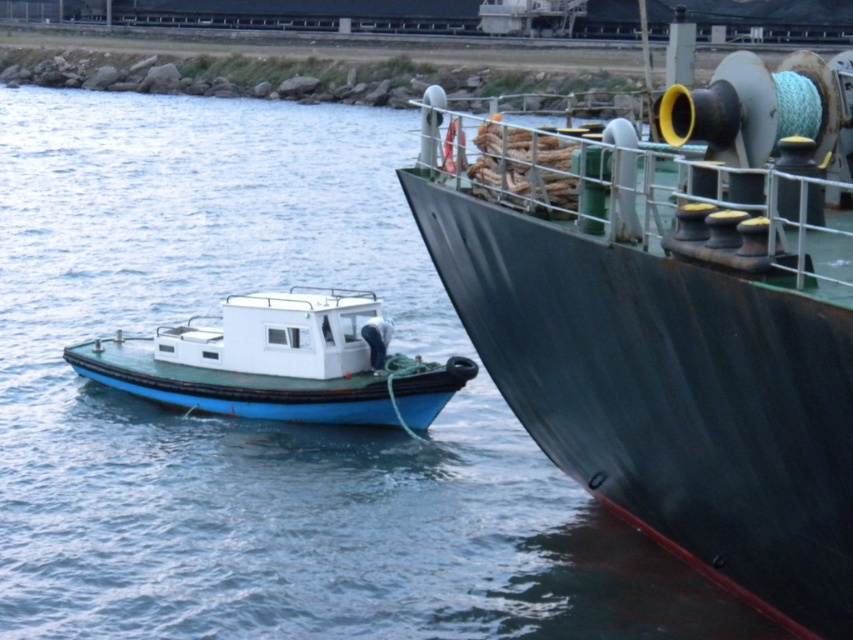
You are a dock worker who needs to secure both the rusty metal ship at right and the blue matte boat at left. From your vantage point on the dock, which vessel is closer to you?

The rusty metal ship at right is closer to you because it is positioned in front of the blue matte boat at left, meaning the blue matte boat at left is farther away.

You are a dock worker who needs to secure the rusty metal ship at right and the blue matte boat at left. Given their positions, which one is closer to the dock on the left side?

The blue matte boat at left is closer to the dock on the left side since it is positioned to the left of the rusty metal ship at right.

You are standing on the deck of the rusty metal ship at right. You see a point at coordinate [672,314]. What object is located at that point?

The point at coordinate [672,314] is located on the rusty metal ship at right.